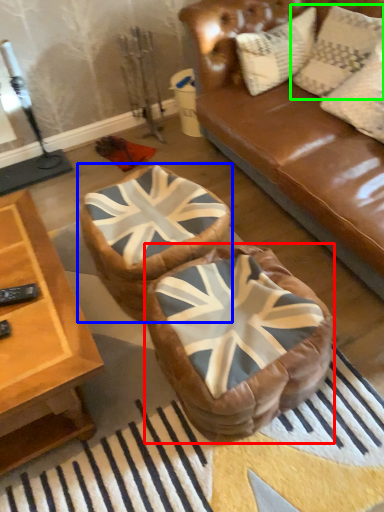
Question: Which object is positioned farthest from bean bag chair (highlighted by a red box)? Select from bean bag chair (highlighted by a blue box) and pillow (highlighted by a green box).

Choices:
 (A) bean bag chair
 (B) pillow

Answer: (B)